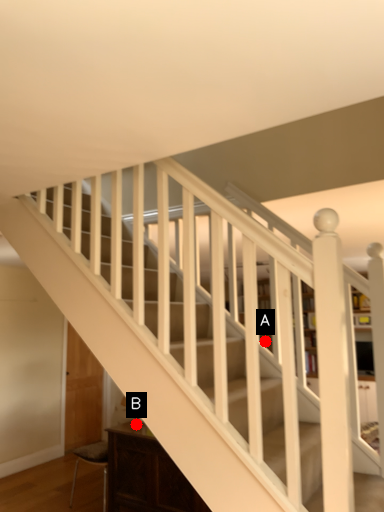
Question: Two points are circled on the image, labeled by A and B beside each circle. Which point is farther from the camera taking this photo?

Choices:
 (A) A is further
 (B) B is further

Answer: (B)